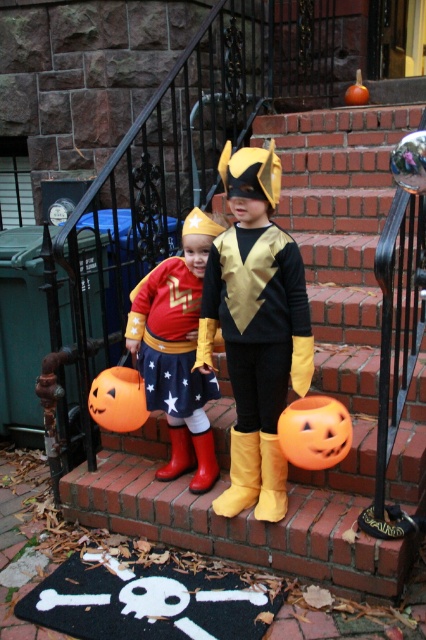
Identify the location of orange matte pumpkin at center. The width and height of the screenshot is (426, 640). (118, 400).

Between point (104, 413) and point (363, 99), which one is positioned in front?

Point (104, 413) is more forward.

The height and width of the screenshot is (640, 426). Identify the location of orange matte pumpkin at center. (118, 400).

Is orange matte pumpkin at lower center to the right of smooth orange pumpkin at upper right from the viewer's perspective?

In fact, orange matte pumpkin at lower center is to the left of smooth orange pumpkin at upper right.

Which is below, orange matte pumpkin at lower center or smooth orange pumpkin at upper right?

Positioned lower is orange matte pumpkin at lower center.

Who is more forward, (x=288, y=442) or (x=345, y=97)?

Point (x=288, y=442) is more forward.

Locate an element on the screen. The image size is (426, 640). orange matte pumpkin at lower center is located at coordinates (314, 432).

Does brick stairs at center appear under smooth orange pumpkin at upper right?

Yes, brick stairs at center is below smooth orange pumpkin at upper right.

Between point (97, 467) and point (354, 90), which one is positioned in front?

Positioned in front is point (97, 467).

This screenshot has width=426, height=640. I want to click on brick stairs at center, so click(x=311, y=381).